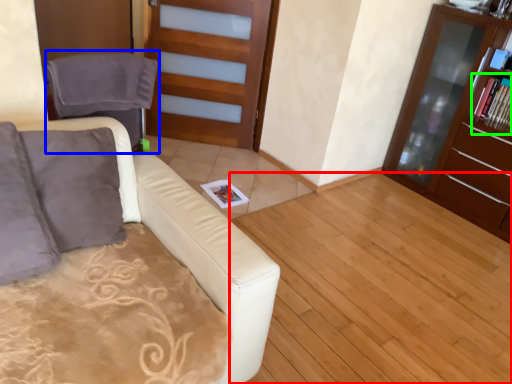
Question: Which object is the farthest from hardwood (highlighted by a red box)? Choose among these: swivel chair (highlighted by a blue box) or magazine (highlighted by a green box).

Choices:
 (A) swivel chair
 (B) magazine

Answer: (A)